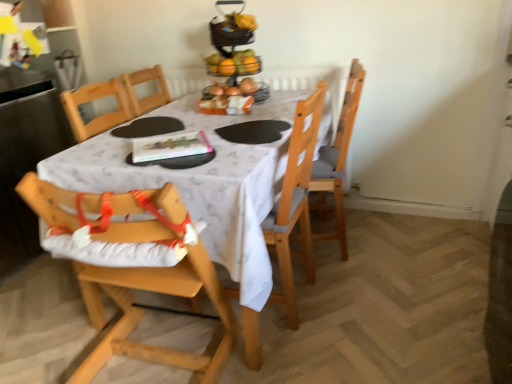
What do you see at coordinates (295, 200) in the screenshot? I see `wooden chair at center, acting as the 2th chair starting from the left` at bounding box center [295, 200].

This screenshot has height=384, width=512. What do you see at coordinates (337, 163) in the screenshot?
I see `wooden chair at right, marked as the 3th chair in a left-to-right arrangement` at bounding box center [337, 163].

Describe the element at coordinates (234, 64) in the screenshot. The height and width of the screenshot is (384, 512). I see `shiny metallic fruit basket at upper center` at that location.

What do you see at coordinates (232, 97) in the screenshot?
I see `orange plastic basket at center` at bounding box center [232, 97].

Describe the element at coordinates (143, 312) in the screenshot. This screenshot has width=512, height=384. I see `wooden highchair at lower left, the third chair when ordered from right to left` at that location.

Where is `wooden chair at center, acting as the second chair starting from the right`? The image size is (512, 384). wooden chair at center, acting as the second chair starting from the right is located at coordinates point(295,200).

Is wooden chair at center, acting as the 2th chair starting from the left, situated inside white fabric table at center or outside?

wooden chair at center, acting as the 2th chair starting from the left, can be found inside white fabric table at center.

Is wooden chair at center, acting as the 2th chair starting from the left, looking in the opposite direction of white fabric table at center?

Yes, wooden chair at center, acting as the 2th chair starting from the left,'s orientation is away from white fabric table at center.

From the image's perspective, between wooden chair at center, acting as the second chair starting from the right, and white fabric table at center, which one is located above?

From the image's view, white fabric table at center is above.

From a real-world perspective, is wooden chair at center, acting as the 2th chair starting from the left, physically above white fabric table at center?

Yes, from a real-world perspective, wooden chair at center, acting as the 2th chair starting from the left, is over white fabric table at center

Are shiny metallic fruit basket at upper center and wooden chair at right, which appears as the 1th chair when viewed from the right, located far from each other?

That's not correct — shiny metallic fruit basket at upper center is a little close to wooden chair at right, which appears as the 1th chair when viewed from the right.

In terms of size, does shiny metallic fruit basket at upper center appear bigger or smaller than wooden chair at right, which appears as the 1th chair when viewed from the right?

Considering their sizes, shiny metallic fruit basket at upper center takes up less space than wooden chair at right, which appears as the 1th chair when viewed from the right.

From the image's perspective, would you say shiny metallic fruit basket at upper center is shown under wooden chair at right, which appears as the 1th chair when viewed from the right?

Incorrect, from the image's perspective, shiny metallic fruit basket at upper center is higher than wooden chair at right, which appears as the 1th chair when viewed from the right.

In terms of width, does shiny metallic fruit basket at upper center look wider or thinner when compared to wooden chair at right, marked as the 3th chair in a left-to-right arrangement?

In the image, shiny metallic fruit basket at upper center appears to be more narrow than wooden chair at right, marked as the 3th chair in a left-to-right arrangement.

I want to click on the 3rd chair in front of the shiny metallic fruit basket at upper center, counting from the anchor's position, so click(143, 312).

Could you tell me if shiny metallic fruit basket at upper center is facing wooden highchair at lower left, positioned as the 1th chair in left-to-right order?

No, shiny metallic fruit basket at upper center is not oriented towards wooden highchair at lower left, positioned as the 1th chair in left-to-right order.

Can you confirm if shiny metallic fruit basket at upper center is taller than wooden highchair at lower left, positioned as the 1th chair in left-to-right order?

In fact, shiny metallic fruit basket at upper center may be shorter than wooden highchair at lower left, positioned as the 1th chair in left-to-right order.

Between shiny metallic fruit basket at upper center and wooden highchair at lower left, the third chair when ordered from right to left, which one has smaller width?

shiny metallic fruit basket at upper center.

How different are the orientations of white fabric table at center and wooden highchair at lower left, positioned as the 1th chair in left-to-right order, in degrees?

white fabric table at center and wooden highchair at lower left, positioned as the 1th chair in left-to-right order, are facing 180 degrees away from each other.

From the picture: Which object is further away from the camera, white fabric table at center or wooden highchair at lower left, the third chair when ordered from right to left?

Positioned behind is white fabric table at center.

This screenshot has width=512, height=384. Identify the location of table behind the wooden highchair at lower left, positioned as the 1th chair in left-to-right order. (204, 191).

Considering the relative sizes of white fabric table at center and wooden highchair at lower left, the third chair when ordered from right to left, in the image provided, is white fabric table at center wider than wooden highchair at lower left, the third chair when ordered from right to left,?

Indeed, white fabric table at center has a greater width compared to wooden highchair at lower left, the third chair when ordered from right to left.

Which of these two, wooden chair at right, which appears as the 1th chair when viewed from the right, or shiny metallic fruit basket at upper center, stands shorter?

shiny metallic fruit basket at upper center.

Is wooden chair at right, marked as the 3th chair in a left-to-right arrangement, at the left side of shiny metallic fruit basket at upper center?

Incorrect, wooden chair at right, marked as the 3th chair in a left-to-right arrangement, is not on the left side of shiny metallic fruit basket at upper center.

From a real-world perspective, does wooden chair at right, marked as the 3th chair in a left-to-right arrangement, stand above shiny metallic fruit basket at upper center?

Incorrect, from a real-world perspective, wooden chair at right, marked as the 3th chair in a left-to-right arrangement, is lower than shiny metallic fruit basket at upper center.

Would you say wooden chair at center, acting as the 2th chair starting from the left, is inside or outside orange plastic basket at center?

The correct answer is: outside.

Can you confirm if wooden chair at center, acting as the 2th chair starting from the left, is taller than orange plastic basket at center?

Indeed, wooden chair at center, acting as the 2th chair starting from the left, has a greater height compared to orange plastic basket at center.

Which is more to the left, wooden chair at center, acting as the second chair starting from the right, or orange plastic basket at center?

orange plastic basket at center is more to the left.

Is shiny metallic fruit basket at upper center positioned with its back to wooden chair at center, acting as the second chair starting from the right?

No, shiny metallic fruit basket at upper center is not facing the opposite direction of wooden chair at center, acting as the second chair starting from the right.

Based on the photo, is wooden chair at center, acting as the second chair starting from the right, located within shiny metallic fruit basket at upper center?

That's incorrect, wooden chair at center, acting as the second chair starting from the right, is not inside shiny metallic fruit basket at upper center.

Can you tell me how much shiny metallic fruit basket at upper center and wooden chair at center, acting as the 2th chair starting from the left, differ in facing direction?

91.6 degrees separate the facing orientations of shiny metallic fruit basket at upper center and wooden chair at center, acting as the 2th chair starting from the left.

Which is closer to the camera, (x=257, y=66) or (x=297, y=113)?

The point (x=297, y=113) is closer.

Where is `table located in front of the wooden chair at center, acting as the second chair starting from the right`? This screenshot has height=384, width=512. table located in front of the wooden chair at center, acting as the second chair starting from the right is located at coordinates (204, 191).

Where is `the 2nd chair counting from the right of the shiny metallic fruit basket at upper center`? Image resolution: width=512 pixels, height=384 pixels. the 2nd chair counting from the right of the shiny metallic fruit basket at upper center is located at coordinates (x=337, y=163).

Looking at the image, which one is located closer to wooden chair at right, marked as the 3th chair in a left-to-right arrangement, wooden highchair at lower left, the third chair when ordered from right to left, or wooden chair at center, acting as the 2th chair starting from the left?

wooden chair at center, acting as the 2th chair starting from the left.

Estimate the real-world distances between objects in this image. Which object is closer to wooden chair at center, acting as the second chair starting from the right, shiny metallic fruit basket at upper center or orange plastic basket at center?

orange plastic basket at center is positioned closer to the anchor wooden chair at center, acting as the second chair starting from the right.

When comparing their distances from wooden highchair at lower left, positioned as the 1th chair in left-to-right order, does wooden chair at right, marked as the 3th chair in a left-to-right arrangement, or orange plastic basket at center seem further?

Based on the image, wooden chair at right, marked as the 3th chair in a left-to-right arrangement, appears to be further to wooden highchair at lower left, positioned as the 1th chair in left-to-right order.

Considering their positions, is shiny metallic fruit basket at upper center positioned further to wooden highchair at lower left, the third chair when ordered from right to left, than orange plastic basket at center?

shiny metallic fruit basket at upper center is positioned further to the anchor wooden highchair at lower left, the third chair when ordered from right to left.

When comparing their distances from shiny metallic fruit basket at upper center, does wooden chair at center, acting as the second chair starting from the right, or orange plastic basket at center seem closer?

orange plastic basket at center is positioned closer to the anchor shiny metallic fruit basket at upper center.

Looking at the image, which one is located further to white fabric table at center, wooden highchair at lower left, the third chair when ordered from right to left, or orange plastic basket at center?

Based on the image, orange plastic basket at center appears to be further to white fabric table at center.

Based on their spatial positions, is wooden chair at right, which appears as the 1th chair when viewed from the right, or wooden highchair at lower left, the third chair when ordered from right to left, closer to shiny metallic fruit basket at upper center?

Based on the image, wooden chair at right, which appears as the 1th chair when viewed from the right, appears to be nearer to shiny metallic fruit basket at upper center.

When comparing their distances from wooden chair at center, acting as the 2th chair starting from the left, does shiny metallic fruit basket at upper center or wooden highchair at lower left, positioned as the 1th chair in left-to-right order, seem further?

shiny metallic fruit basket at upper center is positioned further to the anchor wooden chair at center, acting as the 2th chair starting from the left.

Where is `table between wooden highchair at lower left, the third chair when ordered from right to left, and wooden chair at right, marked as the 3th chair in a left-to-right arrangement, in the front-back direction`? table between wooden highchair at lower left, the third chair when ordered from right to left, and wooden chair at right, marked as the 3th chair in a left-to-right arrangement, in the front-back direction is located at coordinates (204, 191).

You are a GUI agent. You are given a task and a screenshot of the screen. Output one action in this format:
    pyautogui.click(x=<x>, y=<y>)
    Task: Click on the table between wooden highchair at lower left, the third chair when ordered from right to left, and orange plastic basket at center in the front-back direction
    The width and height of the screenshot is (512, 384).
    Given the screenshot: What is the action you would take?
    pyautogui.click(x=204, y=191)

You are a GUI agent. You are given a task and a screenshot of the screen. Output one action in this format:
    pyautogui.click(x=<x>, y=<y>)
    Task: Click on the chair positioned between white fabric table at center and wooden chair at right, marked as the 3th chair in a left-to-right arrangement, from near to far
    The image size is (512, 384).
    Given the screenshot: What is the action you would take?
    (295, 200)

At what (x,y) coordinates should I click in order to perform the action: click on chair between wooden highchair at lower left, the third chair when ordered from right to left, and wooden chair at right, which appears as the 1th chair when viewed from the right, along the z-axis. Please return your answer as a coordinate pair (x, y). The image size is (512, 384). Looking at the image, I should click on (295, 200).